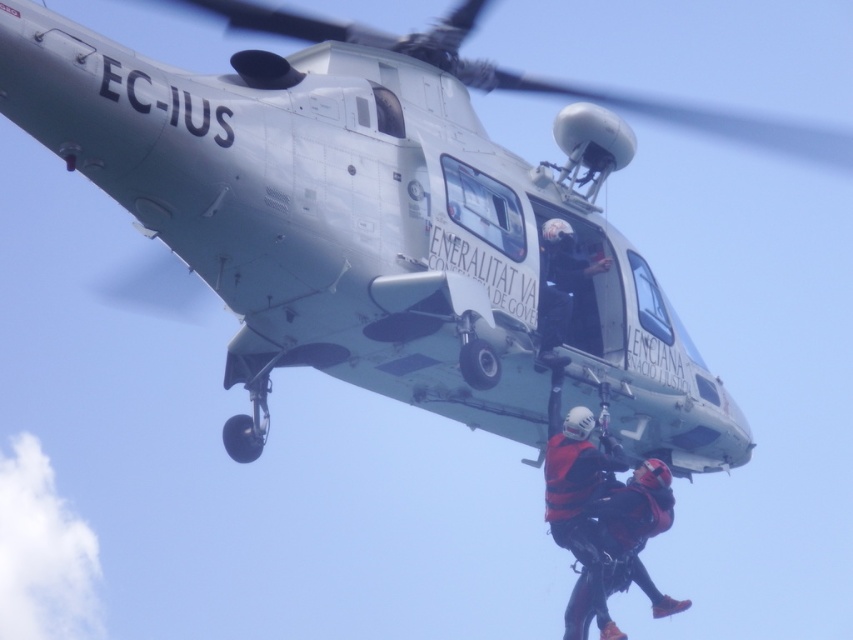
Question: Is red matte helmet at center to the left of black helmet at upper center from the viewer's perspective?

Choices:
 (A) yes
 (B) no

Answer: (B)

Question: Is red matte life vest at center smaller than red matte helmet at center?

Choices:
 (A) yes
 (B) no

Answer: (A)

Question: Is red matte helmet at center to the left of black helmet at upper center from the viewer's perspective?

Choices:
 (A) no
 (B) yes

Answer: (A)

Question: Which point is closer to the camera?

Choices:
 (A) red matte life vest at center
 (B) red matte helmet at center

Answer: (A)

Question: Which of the following is the closest to the observer?

Choices:
 (A) red matte life vest at center
 (B) black helmet at upper center

Answer: (B)

Question: Among these objects, which one is farthest from the camera?

Choices:
 (A) red matte helmet at center
 (B) red matte life vest at center

Answer: (A)